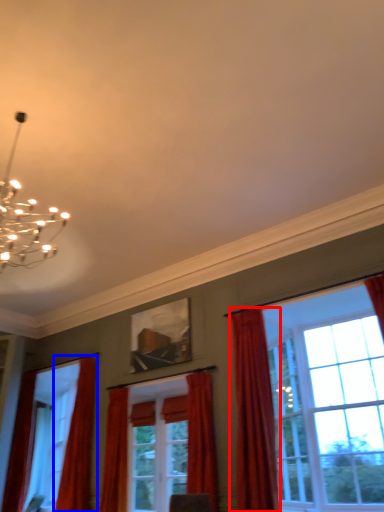
Question: Which object is closer to the camera taking this photo, curtain (highlighted by a red box) or curtain (highlighted by a blue box)?

Choices:
 (A) curtain
 (B) curtain

Answer: (A)